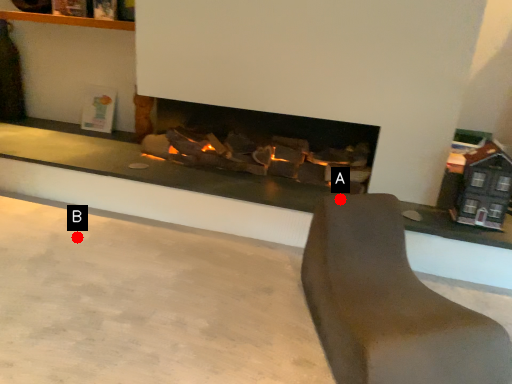
Question: Two points are circled on the image, labeled by A and B beside each circle. Which point is closer to the camera?

Choices:
 (A) A is closer
 (B) B is closer

Answer: (A)